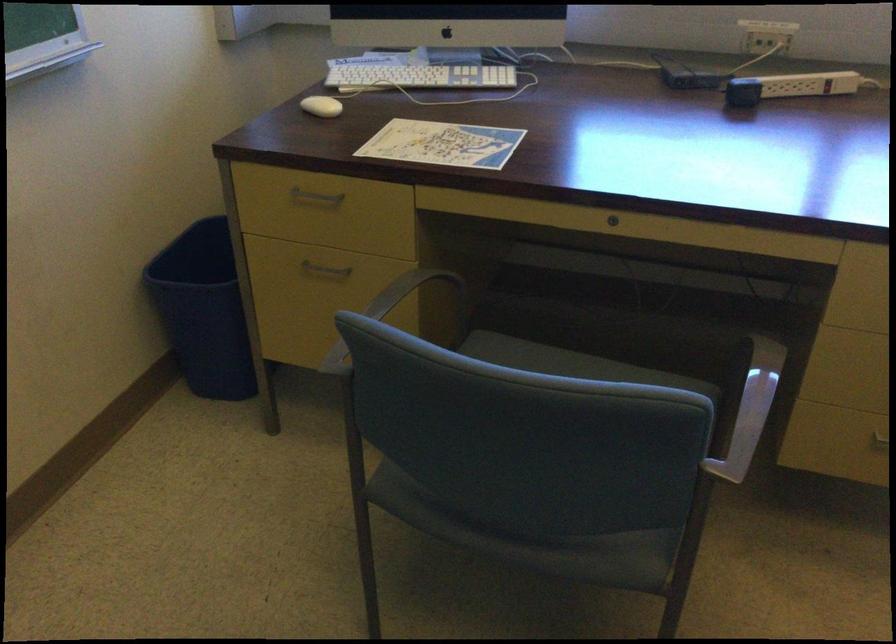
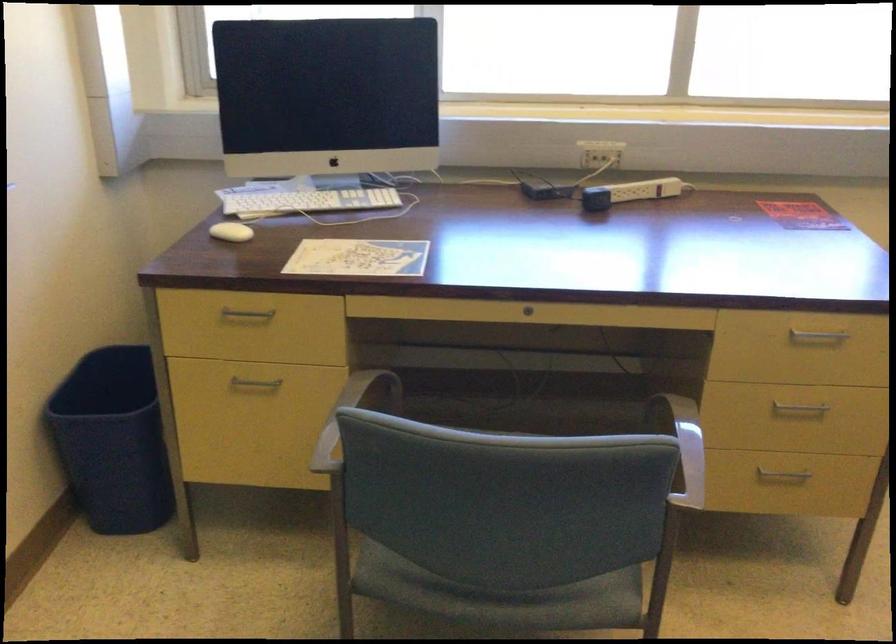
The point at [349,323] is marked in the first image. Where is the corresponding point in the second image?

(350, 415)